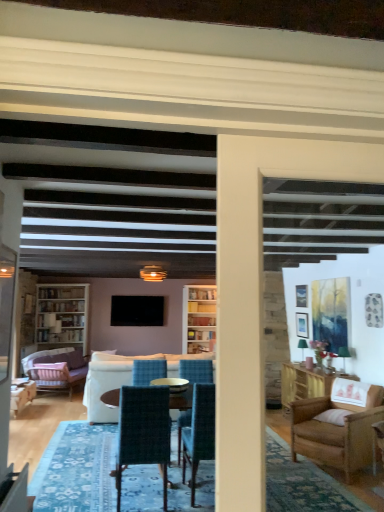
Question: From a real-world perspective, is white wood bookcase at left on velvet teal chair at center, the 2th chair positioned from the left?

Choices:
 (A) no
 (B) yes

Answer: (B)

Question: From the image's perspective, is white wood bookcase at left on top of velvet teal chair at center, the first chair from the front?

Choices:
 (A) yes
 (B) no

Answer: (A)

Question: Would you consider white wood bookcase at left to be distant from velvet teal chair at center, the 2th chair positioned from the left?

Choices:
 (A) yes
 (B) no

Answer: (A)

Question: Considering the relative positions of white wood bookcase at left and velvet teal chair at center, the 2th chair positioned from the left, in the image provided, is white wood bookcase at left in front of velvet teal chair at center, the 2th chair positioned from the left,?

Choices:
 (A) no
 (B) yes

Answer: (A)

Question: Is white wood bookcase at left smaller than velvet teal chair at center, the first chair from the front?

Choices:
 (A) no
 (B) yes

Answer: (A)

Question: Does point (69, 343) appear closer or farther from the camera than point (162, 310)?

Choices:
 (A) farther
 (B) closer

Answer: (B)

Question: Visually, is white wood bookcase at left positioned to the left or to the right of flat screen tv at center?

Choices:
 (A) left
 (B) right

Answer: (A)

Question: Looking at the image, does white wood bookcase at left seem bigger or smaller compared to flat screen tv at center?

Choices:
 (A) big
 (B) small

Answer: (A)

Question: Is white wood bookcase at left taller or shorter than flat screen tv at center?

Choices:
 (A) tall
 (B) short

Answer: (A)

Question: Looking at the image, does flat screen tv at center seem bigger or smaller compared to velvet teal chair at center, the 2th chair positioned from the left?

Choices:
 (A) small
 (B) big

Answer: (A)

Question: From a real-world perspective, relative to velvet teal chair at center, which is counted as the third chair, starting from the back, is flat screen tv at center vertically above or below?

Choices:
 (A) below
 (B) above

Answer: (B)

Question: Is flat screen tv at center taller or shorter than velvet teal chair at center, the first chair from the front?

Choices:
 (A) short
 (B) tall

Answer: (A)

Question: Is flat screen tv at center situated inside velvet teal chair at center, the 2th chair viewed from the right, or outside?

Choices:
 (A) outside
 (B) inside

Answer: (A)

Question: Choose the correct answer: Is white wood bookcase at left inside velvet pink armchair at lower left, acting as the 3th chair starting from the right, or outside it?

Choices:
 (A) outside
 (B) inside

Answer: (A)

Question: Does point (x=59, y=330) appear closer or farther from the camera than point (x=16, y=409)?

Choices:
 (A) farther
 (B) closer

Answer: (A)